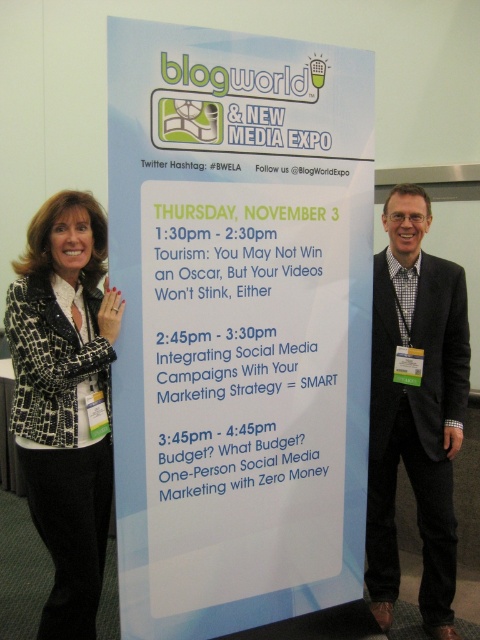
Question: Which object is closer to the camera taking this photo?

Choices:
 (A) black suit at right
 (B) white paperboard sign at center
 (C) leopard print blazer at left

Answer: (B)

Question: Among these points, which one is farthest from the camera?

Choices:
 (A) (372, 328)
 (B) (233, 390)
 (C) (29, 492)

Answer: (A)

Question: Is white paperboard sign at center further to camera compared to black suit at right?

Choices:
 (A) no
 (B) yes

Answer: (A)

Question: Is leopard print blazer at left above black suit at right?

Choices:
 (A) no
 (B) yes

Answer: (B)

Question: Does white paperboard sign at center have a greater width compared to leopard print blazer at left?

Choices:
 (A) yes
 (B) no

Answer: (A)

Question: Among these points, which one is nearest to the camera?

Choices:
 (A) (295, 205)
 (B) (60, 246)
 (C) (370, 589)

Answer: (B)